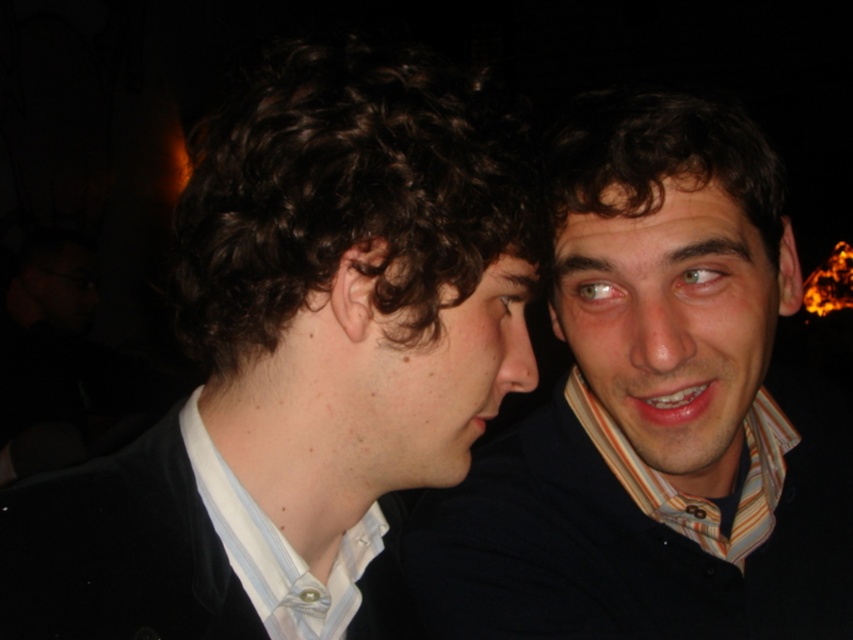
Question: Does matte black suit at left have a smaller size compared to matte black shirt at center?

Choices:
 (A) no
 (B) yes

Answer: (B)

Question: Is matte black suit at left positioned before matte black shirt at center?

Choices:
 (A) yes
 (B) no

Answer: (A)

Question: Which point appears farthest from the camera in this image?

Choices:
 (A) (721, 593)
 (B) (474, 99)

Answer: (A)

Question: Which point is farther to the camera?

Choices:
 (A) (405, 138)
 (B) (595, 244)

Answer: (B)

Question: Is matte black suit at left wider than matte black shirt at center?

Choices:
 (A) no
 (B) yes

Answer: (A)